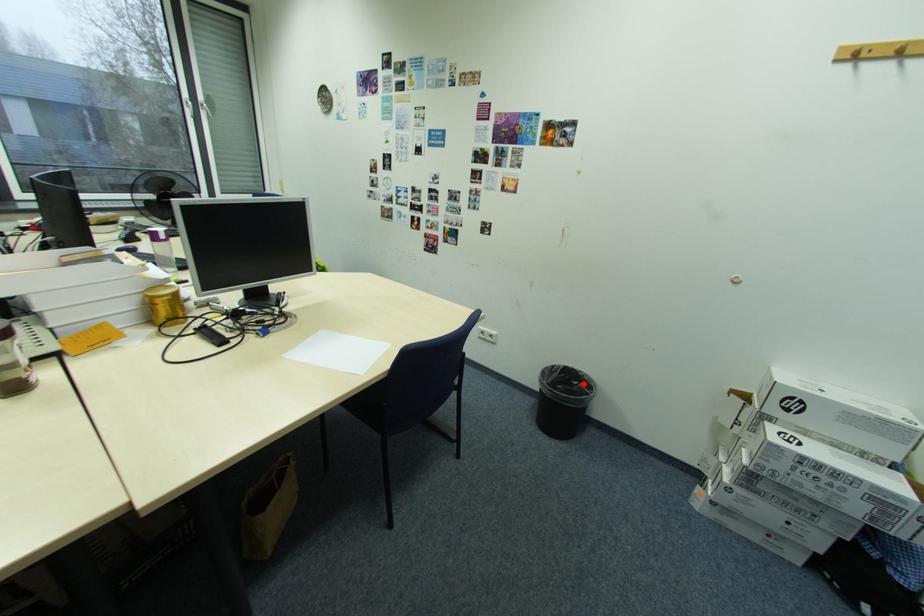
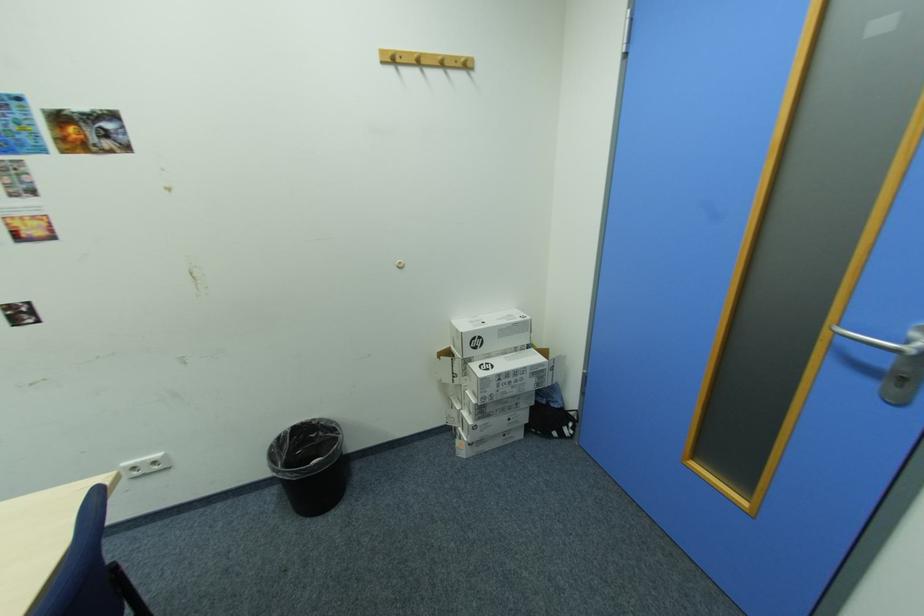
Locate, in the second image, the point that corresponds to the highlighted location in the first image.

(322, 436)